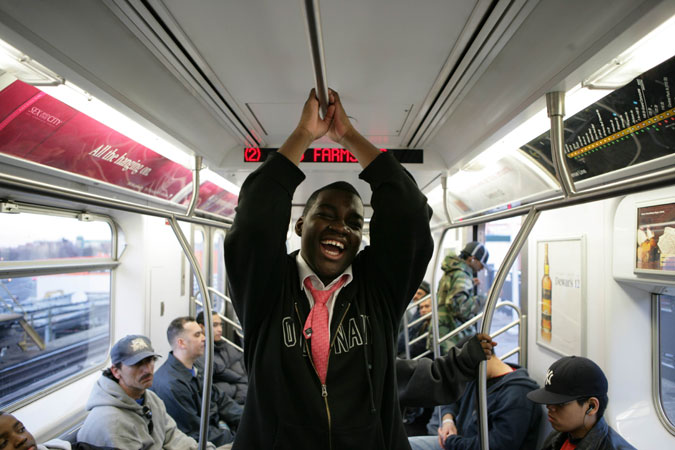
Identify the location of window. (34, 306), (669, 337).